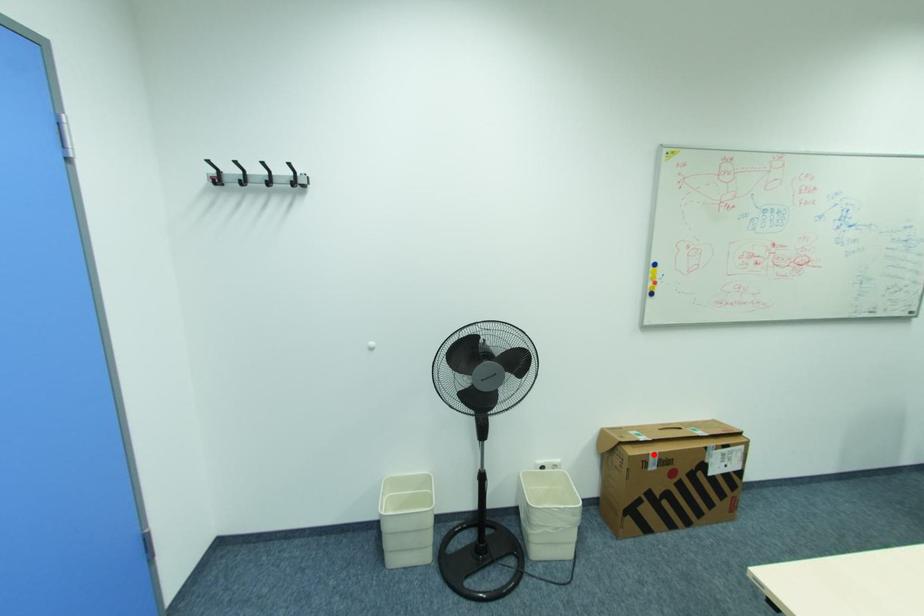
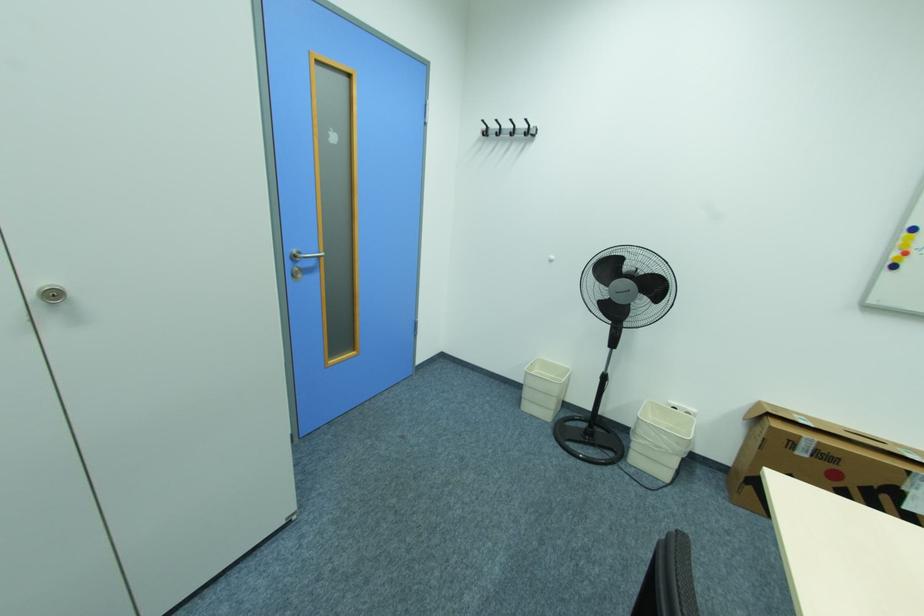
The point at the highlighted location is marked in the first image. Where is the corresponding point in the second image?

(805, 437)